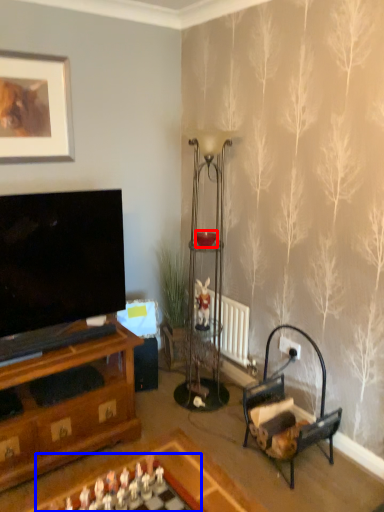
Question: Which object is closer to the camera taking this photo, candle holder (highlighted by a red box) or board game (highlighted by a blue box)?

Choices:
 (A) candle holder
 (B) board game

Answer: (B)